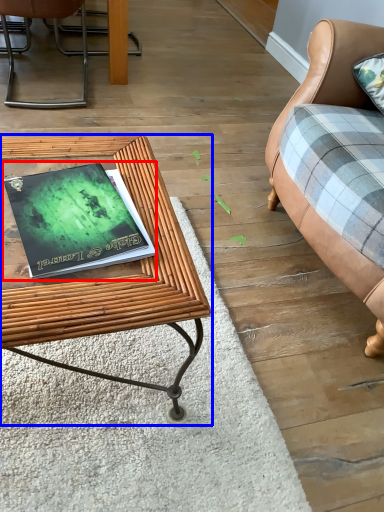
Question: Which of the following is the farthest to the observer, paperback book (highlighted by a red box) or table (highlighted by a blue box)?

Choices:
 (A) paperback book
 (B) table

Answer: (A)